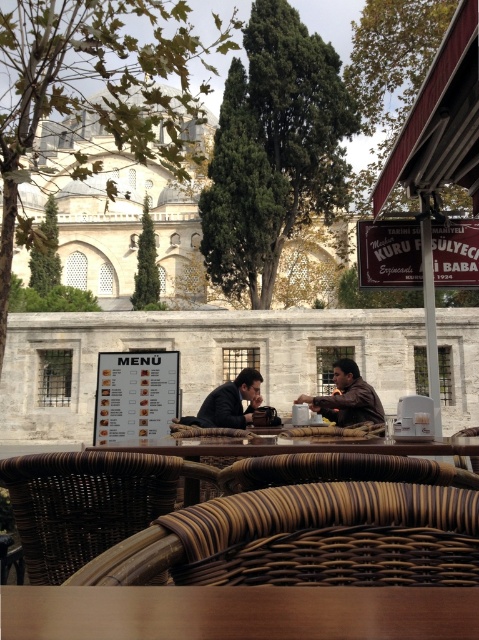
Question: Can you confirm if wooden table at center is positioned above brown woven table at center?

Choices:
 (A) no
 (B) yes

Answer: (B)

Question: Which of the following is the farthest from the observer?

Choices:
 (A) brown leather jacket at center
 (B) wooden table at center

Answer: (A)

Question: Based on their relative distances, which object is nearer to the matte black clothing at center?

Choices:
 (A) brown leather jacket at center
 (B) brown woven table at center
 (C) wooden table at center

Answer: (A)

Question: Which point is farther to the camera?

Choices:
 (A) (351, 417)
 (B) (440, 444)
 (C) (128, 596)
 (D) (346, 412)

Answer: (D)

Question: Does matte black clothing at center have a larger size compared to brown leather jacket at center?

Choices:
 (A) no
 (B) yes

Answer: (B)

Question: Can you confirm if wooden table at center is positioned above brown leather jacket at center?

Choices:
 (A) yes
 (B) no

Answer: (A)